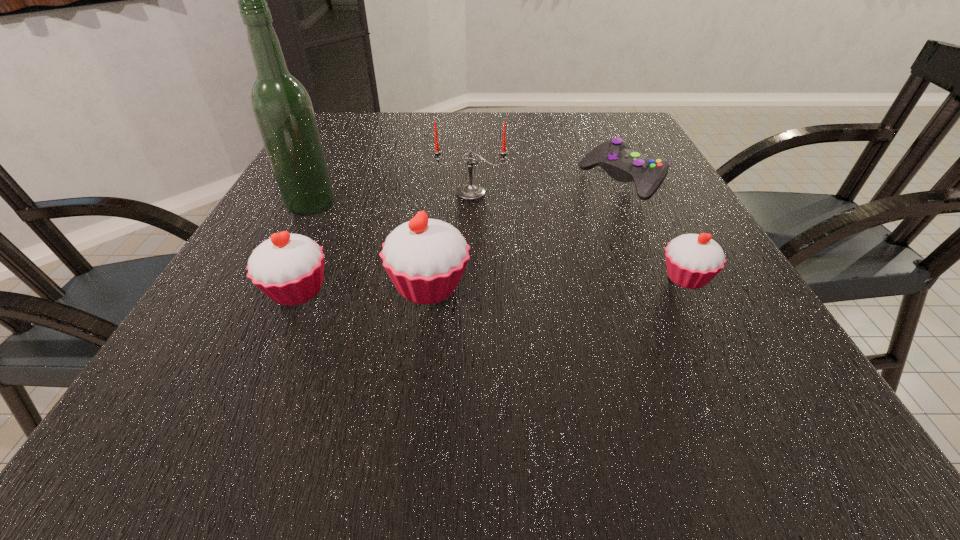
The image size is (960, 540). In the image, there is a desktop. Identify the location of free space at the left edge. (230, 275).

Locate an element on the screen. vacant space at the right edge of the desktop is located at coordinates (707, 331).

In the image, there is a desktop. Identify the location of blank space at the far left corner. The height and width of the screenshot is (540, 960). (361, 113).

Find the location of a particular element. This screenshot has height=540, width=960. free spot between the shortest object and the second cupcake from left to right is located at coordinates (525, 233).

The height and width of the screenshot is (540, 960). Find the location of `vacant area between the tallest cupcake and the tallest object`. vacant area between the tallest cupcake and the tallest object is located at coordinates (371, 246).

Locate an element on the screen. blank region between the tallest object and the candle is located at coordinates (391, 199).

Locate an element on the screen. This screenshot has width=960, height=540. unoccupied position between the leftmost cupcake and the candle is located at coordinates (384, 241).

Find the location of a particular element. The height and width of the screenshot is (540, 960). free space between the candle and the leftmost cupcake is located at coordinates (384, 241).

Find the location of `empty location between the tallest object and the second cupcake from left to right`. empty location between the tallest object and the second cupcake from left to right is located at coordinates (371, 246).

Find the location of a particular element. Image resolution: width=960 pixels, height=540 pixels. vacant space that is in between the candle and the shortest cupcake is located at coordinates (578, 235).